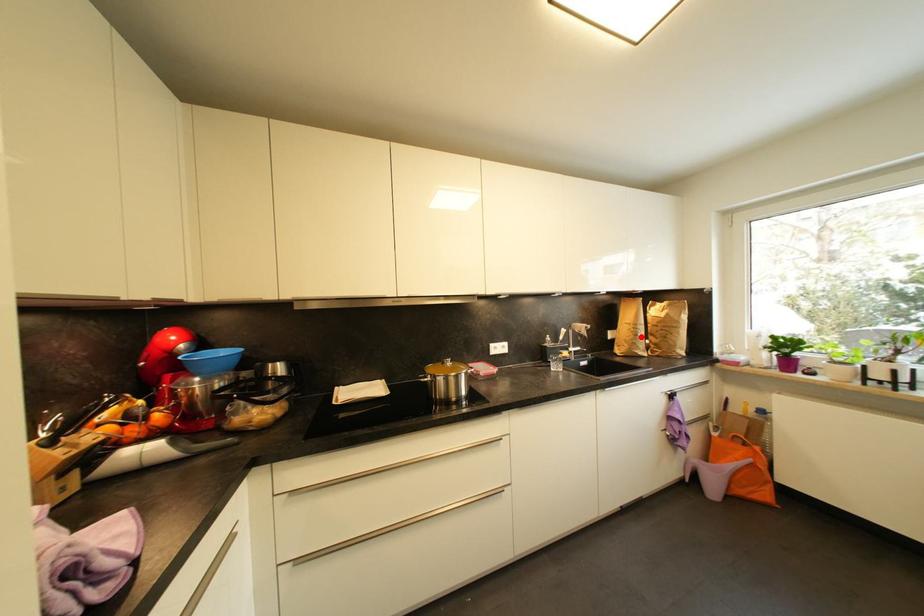
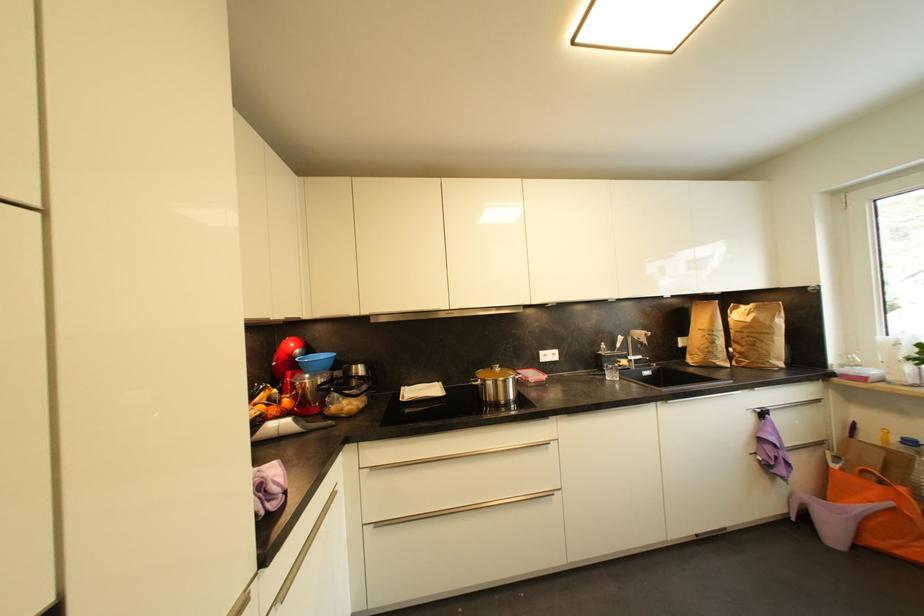
Find the pixel in the second image that matches the highlighted location in the first image.

(718, 345)